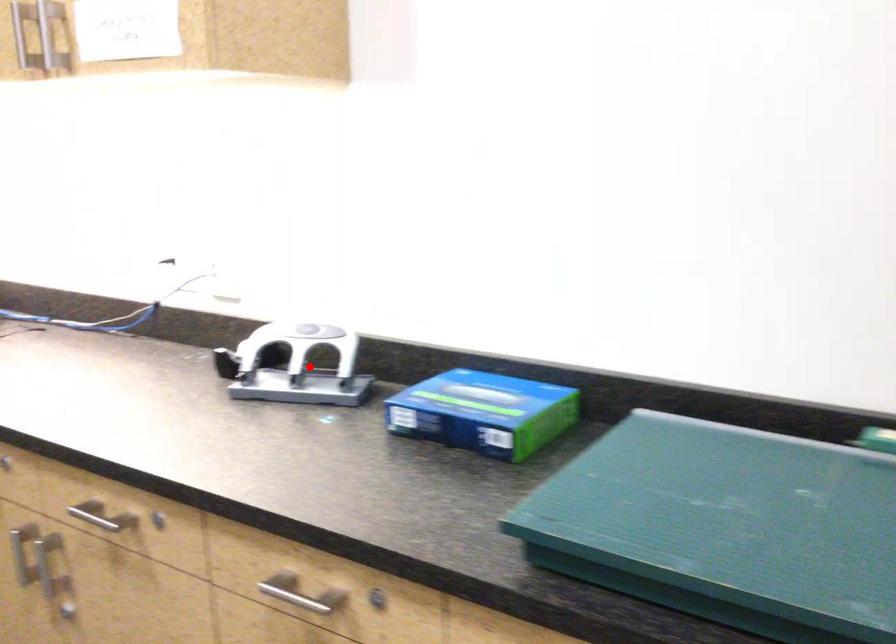
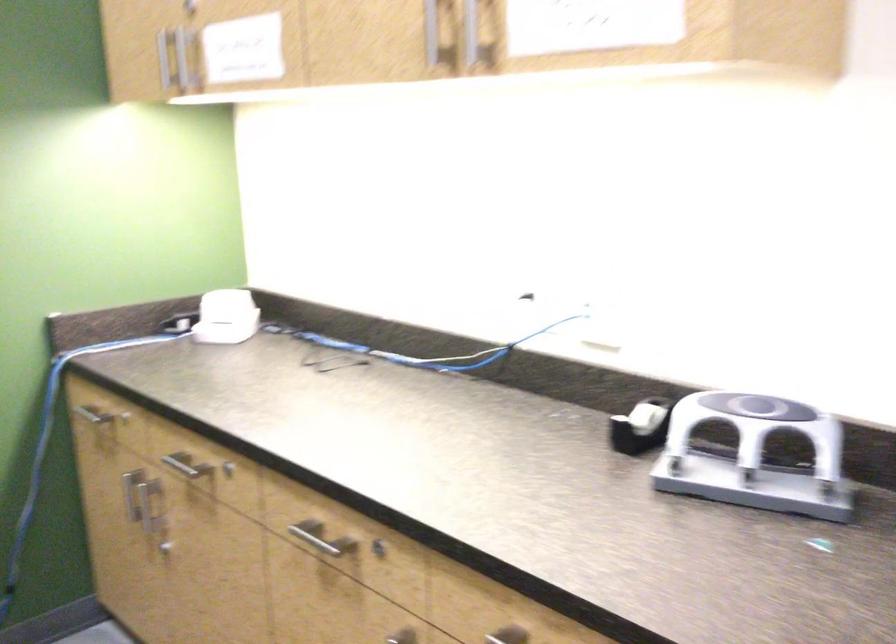
Question: I am providing you with two images of the same scene from different viewpoints. In image1, a red point is highlighted. Considering the same 3D point in image2, which of the following is correct?

Choices:
 (A) It is closer
 (B) It is farther

Answer: (A)